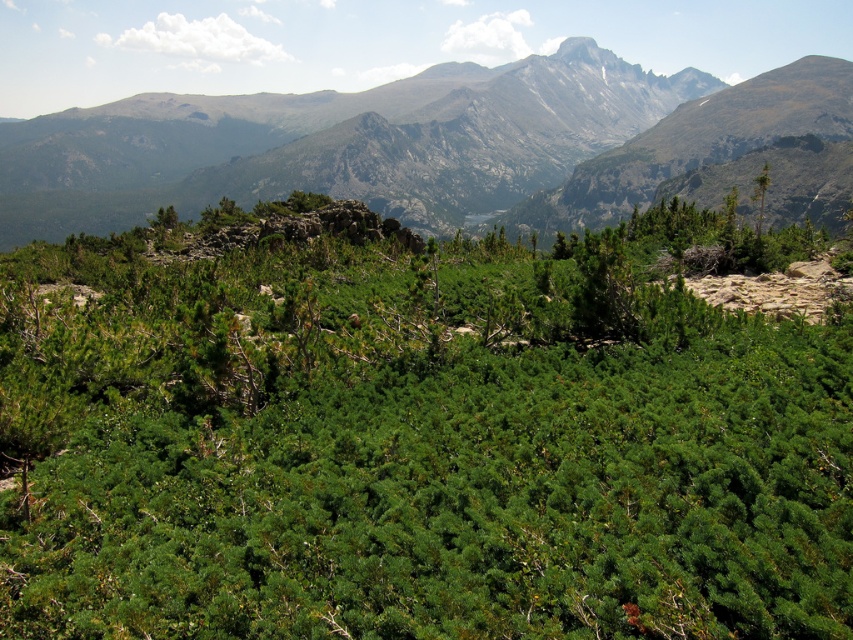
Is rocky gray mountain range at upper center positioned before green needle-like at upper right?

No, it is not.

Between rocky gray mountain range at upper center and green needle-like at upper right, which one is positioned higher?

rocky gray mountain range at upper center is above.

Describe the element at coordinates (335, 144) in the screenshot. I see `rocky gray mountain range at upper center` at that location.

Locate an element on the screen. rocky gray mountain range at upper center is located at coordinates (335, 144).

Does green needle-like plants at center appear over rocky gray mountain range at upper center?

Actually, green needle-like plants at center is below rocky gray mountain range at upper center.

Find the location of a particular element. This screenshot has width=853, height=640. green needle-like plants at center is located at coordinates (416, 440).

Measure the distance between green needle-like plants at center and camera.

green needle-like plants at center and camera are 8.93 feet apart.

The height and width of the screenshot is (640, 853). Find the location of `green needle-like plants at center`. green needle-like plants at center is located at coordinates (416, 440).

In the scene shown: Is green needle-like plants at center thinner than green needle-like at upper right?

Yes, green needle-like plants at center is thinner than green needle-like at upper right.

Between point (476, 342) and point (756, 189), which one is positioned in front?

Point (476, 342)

Between point (386, 564) and point (753, 198), which one is positioned in front?

Point (386, 564) is more forward.

Where is `green needle-like plants at center`? The image size is (853, 640). green needle-like plants at center is located at coordinates (416, 440).